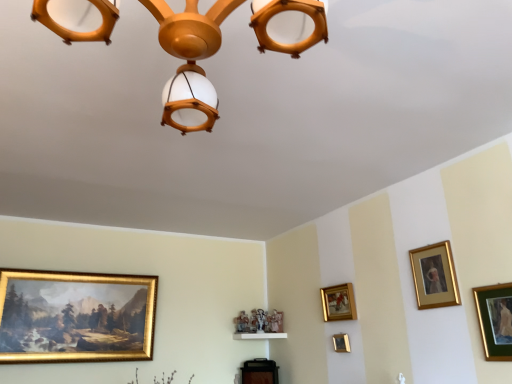
Question: Is gold/gilded picture frame at lower left, which is the 5th picture frame in right-to-left order, taller than gold/gilded picture frame at center-right, positioned as the 4th picture frame in right-to-left order?

Choices:
 (A) yes
 (B) no

Answer: (A)

Question: From a real-world perspective, is gold/gilded picture frame at lower left, the 3th picture frame in the back-to-front sequence, positioned under gold/gilded picture frame at center-right, which is the 2th picture frame from left to right, based on gravity?

Choices:
 (A) no
 (B) yes

Answer: (B)

Question: Is gold/gilded picture frame at lower left, which is the 3th picture frame from front to back, facing towards gold/gilded picture frame at center-right, positioned as the 4th picture frame in right-to-left order?

Choices:
 (A) no
 (B) yes

Answer: (A)

Question: From the image's perspective, is gold/gilded picture frame at lower left, which is the 3th picture frame from front to back, beneath gold/gilded picture frame at center-right, positioned as the 4th picture frame in right-to-left order?

Choices:
 (A) no
 (B) yes

Answer: (B)

Question: Is gold/gilded picture frame at lower left, the 3th picture frame in the back-to-front sequence, positioned beyond the bounds of gold/gilded picture frame at center-right, arranged as the 4th picture frame when viewed from the front?

Choices:
 (A) no
 (B) yes

Answer: (B)

Question: Is point (492, 349) closer or farther from the camera than point (316, 34)?

Choices:
 (A) farther
 (B) closer

Answer: (A)

Question: In terms of width, does green matte picture frame at right, which is the fifth picture frame in back-to-front order, look wider or thinner when compared to wooden chandelier at upper center?

Choices:
 (A) wide
 (B) thin

Answer: (B)

Question: From a real-world perspective, relative to wooden chandelier at upper center, is green matte picture frame at right, which appears as the first picture frame when viewed from the front, vertically above or below?

Choices:
 (A) below
 (B) above

Answer: (A)

Question: Based on their sizes in the image, would you say green matte picture frame at right, which is the fifth picture frame in back-to-front order, is bigger or smaller than wooden chandelier at upper center?

Choices:
 (A) big
 (B) small

Answer: (B)

Question: In terms of width, does green matte picture frame at right, the fifth picture frame from the left, look wider or thinner when compared to gold/gilded picture frame at center-right, the second picture frame in the back-to-front sequence?

Choices:
 (A) wide
 (B) thin

Answer: (B)

Question: Looking at the image, does green matte picture frame at right, which is the first picture frame in right-to-left order, seem bigger or smaller compared to gold/gilded picture frame at center-right, positioned as the 4th picture frame in right-to-left order?

Choices:
 (A) big
 (B) small

Answer: (B)

Question: From the image's perspective, is green matte picture frame at right, which appears as the first picture frame when viewed from the front, above or below gold/gilded picture frame at center-right, positioned as the 4th picture frame in right-to-left order?

Choices:
 (A) below
 (B) above

Answer: (B)

Question: From a real-world perspective, relative to gold/gilded picture frame at center-right, the second picture frame in the back-to-front sequence, is green matte picture frame at right, the fifth picture frame from the left, vertically above or below?

Choices:
 (A) below
 (B) above

Answer: (A)

Question: Is gold/gilded picture frame at lower left, the 3th picture frame in the back-to-front sequence, wider or thinner than gold/gilded picture frame at lower center, the first picture frame when ordered from back to front?

Choices:
 (A) wide
 (B) thin

Answer: (A)

Question: In terms of height, does gold/gilded picture frame at lower left, the 1th picture frame positioned from the left, look taller or shorter compared to gold/gilded picture frame at lower center, the first picture frame when ordered from back to front?

Choices:
 (A) tall
 (B) short

Answer: (A)